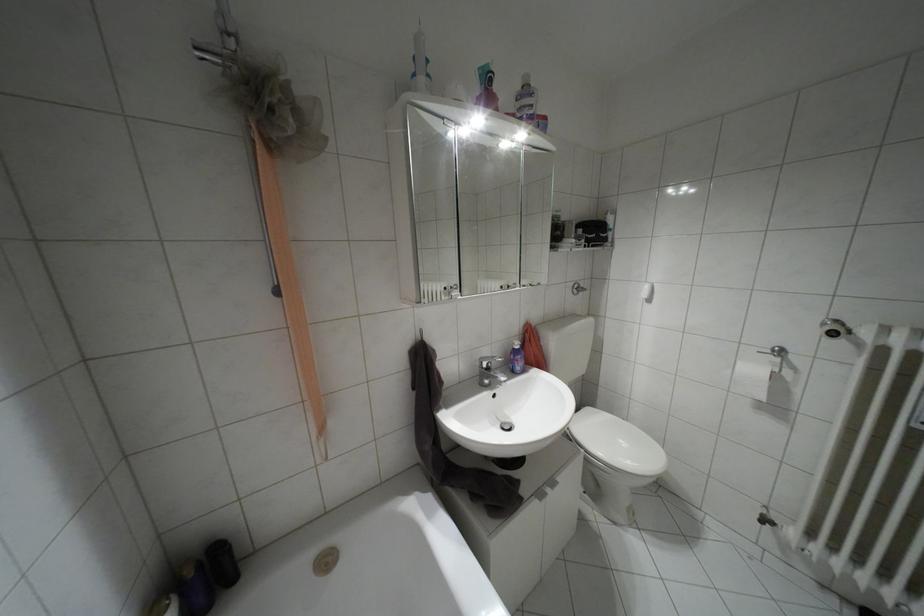
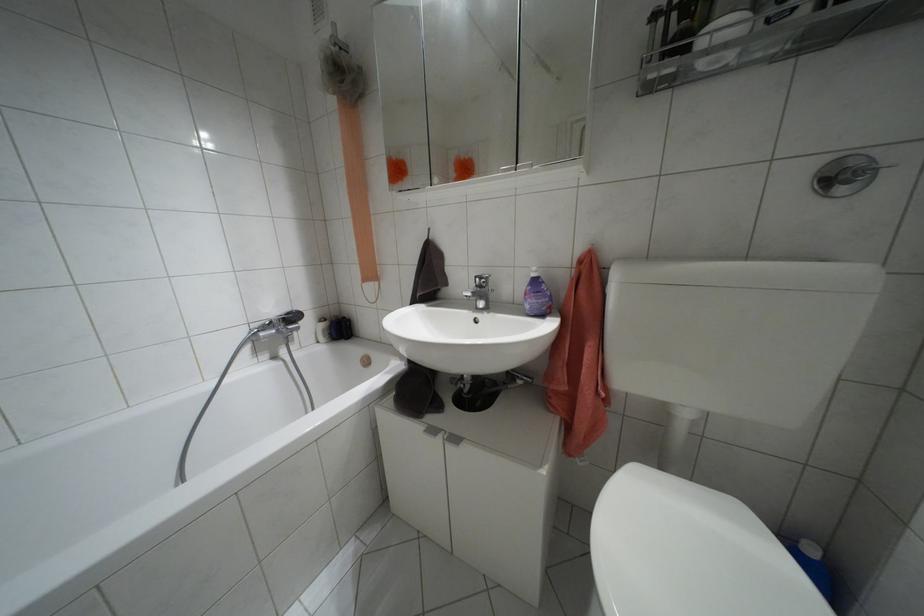
Where in the second image is the point corresponding to (x=552, y=482) from the first image?

(455, 439)